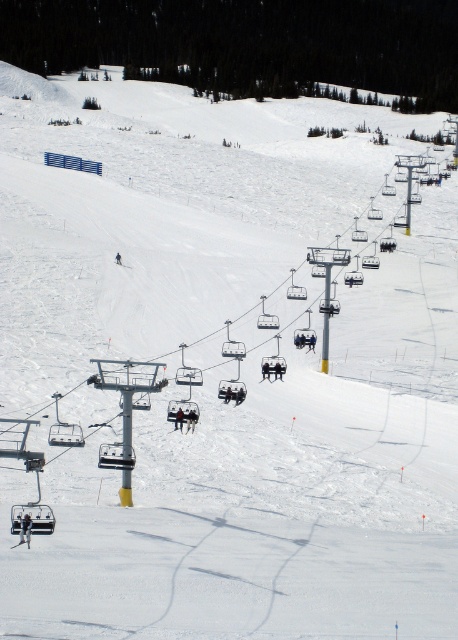
Question: Which point is closer to the camera?

Choices:
 (A) (27, 544)
 (B) (274, 376)
 (C) (28, 538)

Answer: (A)

Question: Where is matte black skier at lower left located in relation to dark blue ski suit at center in the image?

Choices:
 (A) right
 (B) left

Answer: (B)

Question: Can you confirm if matte black chair at center is bigger than black fabric skier at center?

Choices:
 (A) no
 (B) yes

Answer: (B)

Question: Which point is closer to the camera taking this photo?

Choices:
 (A) (262, 372)
 (B) (270, 369)
 (C) (189, 413)
 (D) (21, 540)

Answer: (D)

Question: Observing the image, what is the correct spatial positioning of matte black skier at lower left in reference to matte black chair at center?

Choices:
 (A) right
 (B) left

Answer: (B)

Question: Which of the following is the closest to the observer?

Choices:
 (A) (266, 365)
 (B) (20, 544)
 (C) (273, 372)
 (D) (190, 413)

Answer: (B)